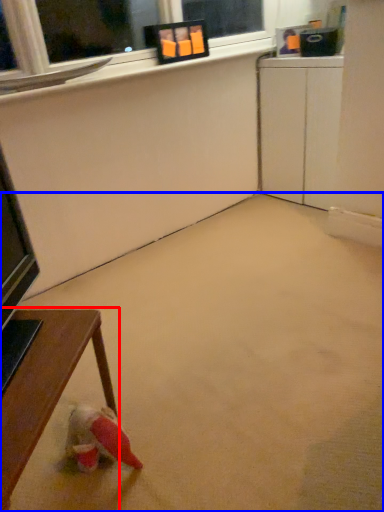
Question: Which object is closer to the camera taking this photo, table (highlighted by a red box) or concrete (highlighted by a blue box)?

Choices:
 (A) table
 (B) concrete

Answer: (B)